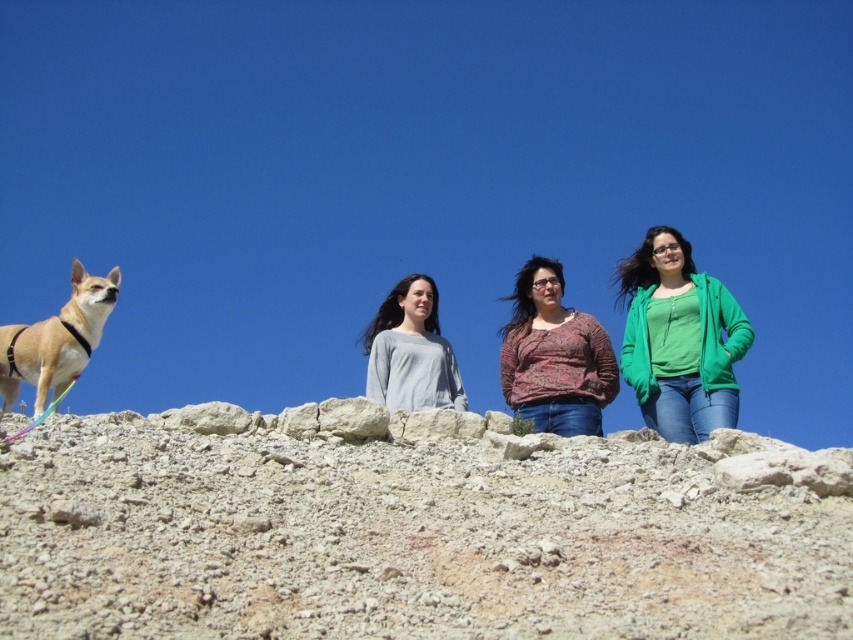
You are standing at the center of the rocky terrain and want to pick up the green matte jacket at right. Which direction should you move to reach it?

You should move towards the right direction to reach the green matte jacket at right since it is located at point (679,339), which is to the right side of the image.

You are a photographer standing at the left side of the image. You want to take a photo of both the green matte jacket at right and the gray matte shirt at center without any obstruction. Which person should move forward or backward to ensure both are visible clearly?

The green matte jacket at right should move backward because it is currently in front of the gray matte shirt at center, blocking part of the view. Moving backward would allow both to be visible without obstruction.